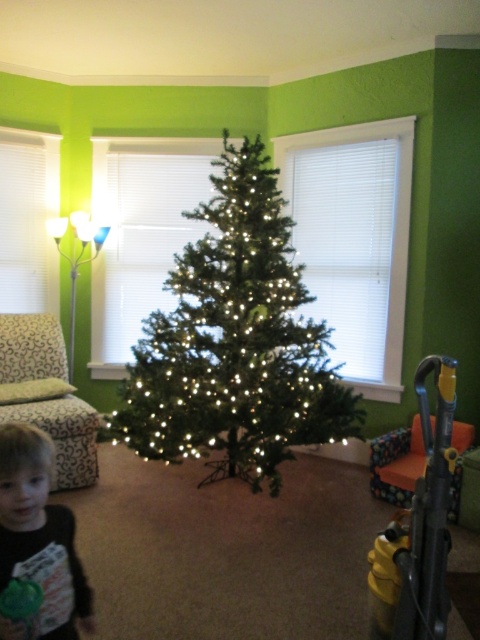
You are standing in the living room and want to place a small gift box between the two points, point (175, 340) and point (31, 474). Which point should the gift box be closer to so it is in front of the other point?

The gift box should be closer to point (31, 474) so it is in front of point (175, 340) because point (175, 340) is behind point (31, 474).

You are a guest at a Christmas party and see the green matte christmas tree at center and the smooth brown shirt at lower left. Which object is closer to you?

The green matte christmas tree at center is closer to you because the smooth brown shirt at lower left is behind it.

You are organizing a Christmas party and need to place a smooth brown shirt at lower left on a shelf next to the green matte christmas tree at center. If the shelf can only hold items up to the width of the shirt, will the tree fit on the same shelf?

The green matte christmas tree at center is wider than the smooth brown shirt at lower left, so it won t fit on the shelf if the shelf can only accommodate the shirt s width.